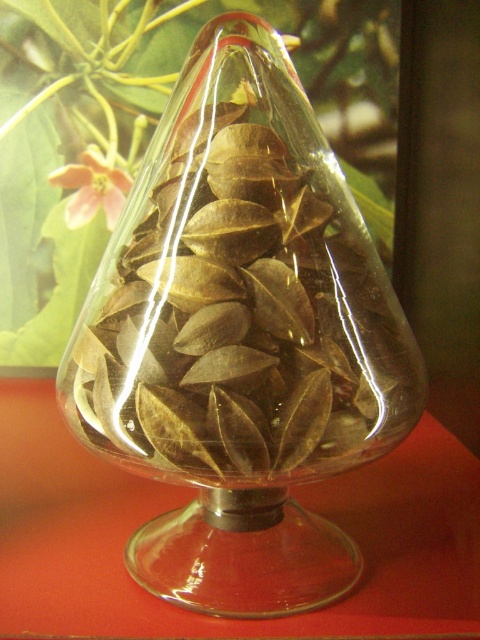
Who is more forward, (360,461) or (86,152)?

Point (360,461) is in front.

Can you confirm if transparent glass vase at center is wider than pink matte flower at upper left?

Yes, transparent glass vase at center is wider than pink matte flower at upper left.

Does point (184, 406) lie behind point (91, 154)?

No, it is not.

Image resolution: width=480 pixels, height=640 pixels. Find the location of `transparent glass vase at center`. transparent glass vase at center is located at coordinates (240, 337).